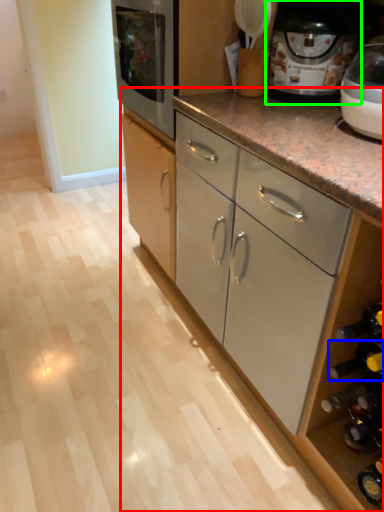
Question: Estimate the real-world distances between objects in this image. Which object is closer to cabinetry (highlighted by a red box), wine bottle (highlighted by a blue box) or home appliance (highlighted by a green box)?

Choices:
 (A) wine bottle
 (B) home appliance

Answer: (B)